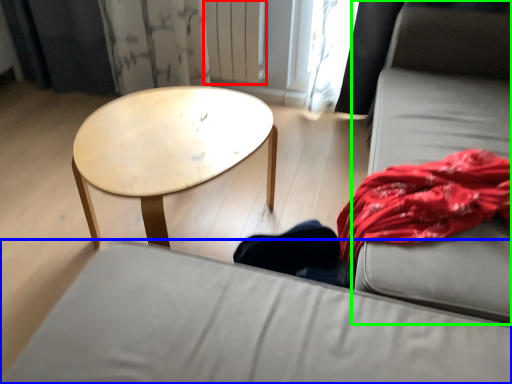
Question: Which object is positioned farthest from radiator (highlighted by a red box)? Select from studio couch (highlighted by a blue box) and couch (highlighted by a green box).

Choices:
 (A) studio couch
 (B) couch

Answer: (A)